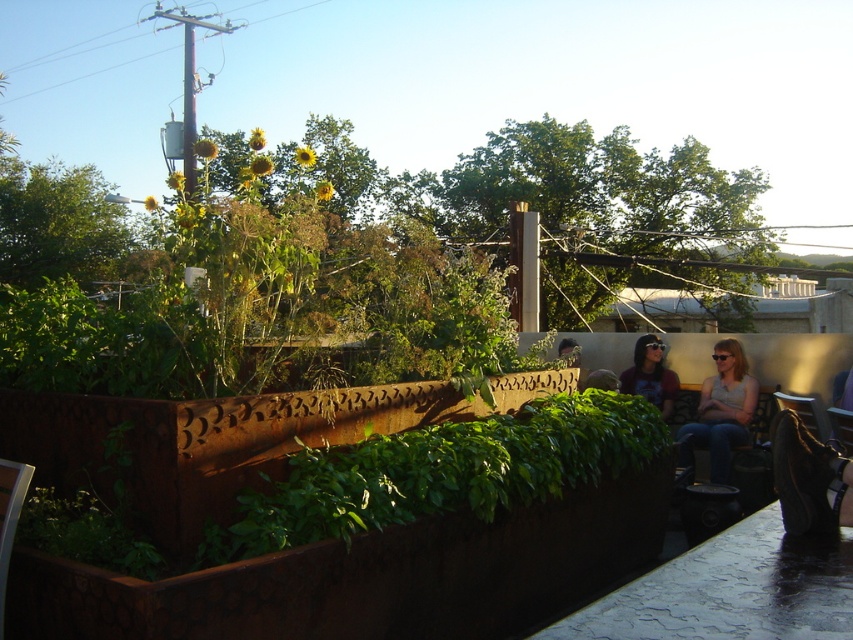
Question: Which of these objects is positioned closest to the matte brown shirt at center?

Choices:
 (A) denim jeans at right
 (B) rusty metal planter at center

Answer: (A)

Question: Can you confirm if rusty metal planter at center is smaller than matte brown shirt at center?

Choices:
 (A) no
 (B) yes

Answer: (A)

Question: Is the position of denim jeans at right less distant than that of matte brown shirt at center?

Choices:
 (A) no
 (B) yes

Answer: (B)

Question: Which point appears closest to the camera in this image?

Choices:
 (A) (677, 451)
 (B) (573, 476)
 (C) (666, 410)

Answer: (B)

Question: Can you confirm if rusty metal planter at center is positioned to the right of matte brown shirt at center?

Choices:
 (A) no
 (B) yes

Answer: (A)

Question: Which point is farther from the camera taking this photo?

Choices:
 (A) (740, 353)
 (B) (627, 381)
 (C) (480, 442)

Answer: (B)